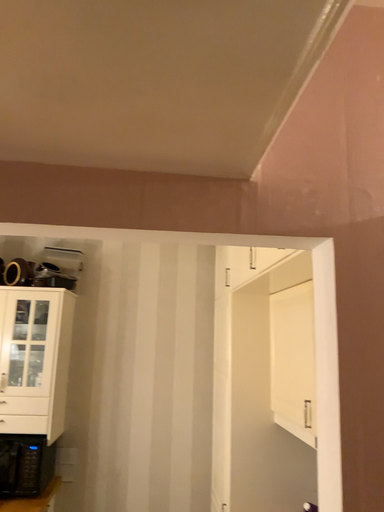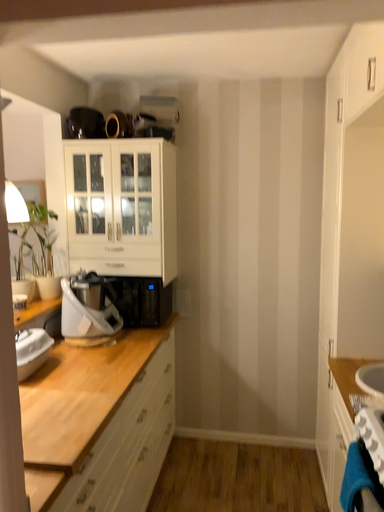
Question: How did the camera likely rotate when shooting the video?

Choices:
 (A) rotated downward
 (B) rotated upward

Answer: (A)